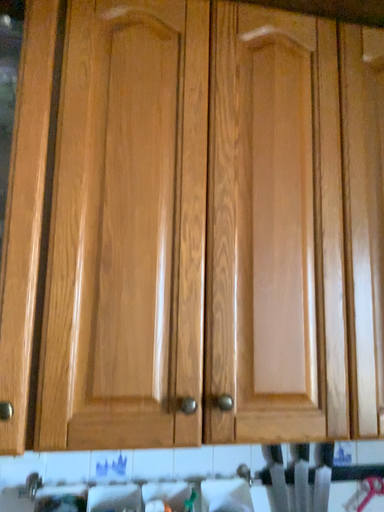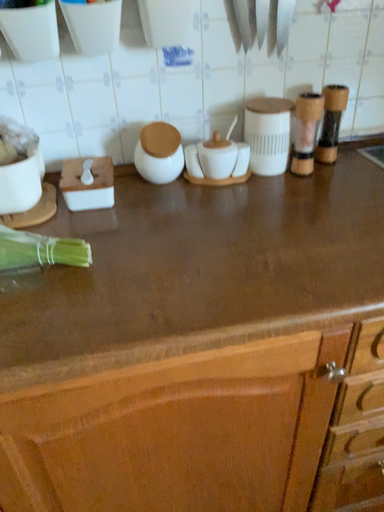
Question: How did the camera likely rotate when shooting the video?

Choices:
 (A) rotated upward
 (B) rotated downward

Answer: (B)